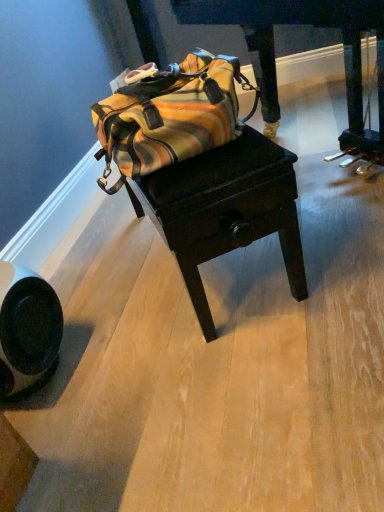
This screenshot has height=512, width=384. I want to click on wooden table at center, so click(227, 210).

The height and width of the screenshot is (512, 384). In order to click on wooden table at center in this screenshot , I will do `click(227, 210)`.

Can you confirm if dark wood drawer at center is positioned to the left of striped canvas duffel bag at center?

Incorrect, dark wood drawer at center is not on the left side of striped canvas duffel bag at center.

Which of these two, dark wood drawer at center or striped canvas duffel bag at center, is smaller?

striped canvas duffel bag at center.

From the image's perspective, between dark wood drawer at center and striped canvas duffel bag at center, who is located below?

striped canvas duffel bag at center appears lower in the image.

Does dark wood drawer at center contain striped canvas duffel bag at center?

No, striped canvas duffel bag at center is not a part of dark wood drawer at center.

Is striped canvas duffel bag at center taller or shorter than dark wood drawer at center?

striped canvas duffel bag at center is shorter than dark wood drawer at center.

Is striped canvas duffel bag at center spatially inside dark wood drawer at center, or outside of it?

striped canvas duffel bag at center cannot be found inside dark wood drawer at center.

Is striped canvas duffel bag at center oriented towards dark wood drawer at center?

Yes.

From a real-world perspective, is striped canvas duffel bag at center located higher than dark wood drawer at center?

Yes, from a real-world perspective, striped canvas duffel bag at center is on top of dark wood drawer at center.

In the scene shown: Who is bigger, wooden table at center or striped canvas duffel bag at center?

With larger size is wooden table at center.

How much distance is there between wooden table at center and striped canvas duffel bag at center?

wooden table at center and striped canvas duffel bag at center are 17.19 centimeters apart from each other.

The image size is (384, 512). Find the location of `luggage and bags above the wooden table at center (from the image's perspective)`. luggage and bags above the wooden table at center (from the image's perspective) is located at coordinates (169, 115).

From the image's perspective, is wooden table at center above striped canvas duffel bag at center?

No.

From the image's perspective, would you say dark wood drawer at center is shown under wooden table at center?

No.

From a real-world perspective, is dark wood drawer at center physically above wooden table at center?

Yes, from a real-world perspective, dark wood drawer at center is on top of wooden table at center.

How far apart are dark wood drawer at center and wooden table at center?

dark wood drawer at center and wooden table at center are 3.70 feet apart from each other.

Which of these two, dark wood drawer at center or wooden table at center, is smaller?

With smaller size is wooden table at center.

From the image's perspective, is wooden table at center on dark wood drawer at center?

No, from the image's perspective, wooden table at center is not on top of dark wood drawer at center.

Could you tell me if wooden table at center is facing dark wood drawer at center?

Yes, wooden table at center is facing dark wood drawer at center.

Can you tell me how much wooden table at center and dark wood drawer at center differ in facing direction?

The angle between the facing direction of wooden table at center and the facing direction of dark wood drawer at center is 174 degrees.

Considering the relative sizes of wooden table at center and dark wood drawer at center in the image provided, is wooden table at center smaller than dark wood drawer at center?

Yes, wooden table at center is smaller than dark wood drawer at center.

Are striped canvas duffel bag at center and wooden table at center located far from each other?

No, there isn't a large distance between striped canvas duffel bag at center and wooden table at center.

Is wooden table at center at the back of striped canvas duffel bag at center?

No, striped canvas duffel bag at center is not facing the opposite direction of wooden table at center.

How much distance is there between striped canvas duffel bag at center and wooden table at center?

striped canvas duffel bag at center and wooden table at center are 6.77 inches apart from each other.

From a real-world perspective, is striped canvas duffel bag at center on top of wooden table at center?

Yes.

Where is `furniture that appears below the striped canvas duffel bag at center (from a real-world perspective)`? furniture that appears below the striped canvas duffel bag at center (from a real-world perspective) is located at coordinates (314, 26).

Find the location of a particular element. furniture that is behind the striped canvas duffel bag at center is located at coordinates (314, 26).

Looking at the image, which one is located closer to wooden table at center, dark wood drawer at center or striped canvas duffel bag at center?

striped canvas duffel bag at center is closer to wooden table at center.

When comparing their distances from dark wood drawer at center, does wooden table at center or striped canvas duffel bag at center seem further?

The object further to dark wood drawer at center is striped canvas duffel bag at center.

Considering their positions, is dark wood drawer at center positioned further to striped canvas duffel bag at center than wooden table at center?

dark wood drawer at center lies further to striped canvas duffel bag at center than the other object.

Based on their spatial positions, is wooden table at center or dark wood drawer at center closer to striped canvas duffel bag at center?

wooden table at center is positioned closer to the anchor striped canvas duffel bag at center.

When comparing their distances from wooden table at center, does striped canvas duffel bag at center or dark wood drawer at center seem further?

dark wood drawer at center.

Consider the image. Looking at the image, which one is located further to dark wood drawer at center, striped canvas duffel bag at center or wooden table at center?

striped canvas duffel bag at center is positioned further to the anchor dark wood drawer at center.

This screenshot has height=512, width=384. I want to click on table between striped canvas duffel bag at center and dark wood drawer at center from left to right, so click(x=227, y=210).